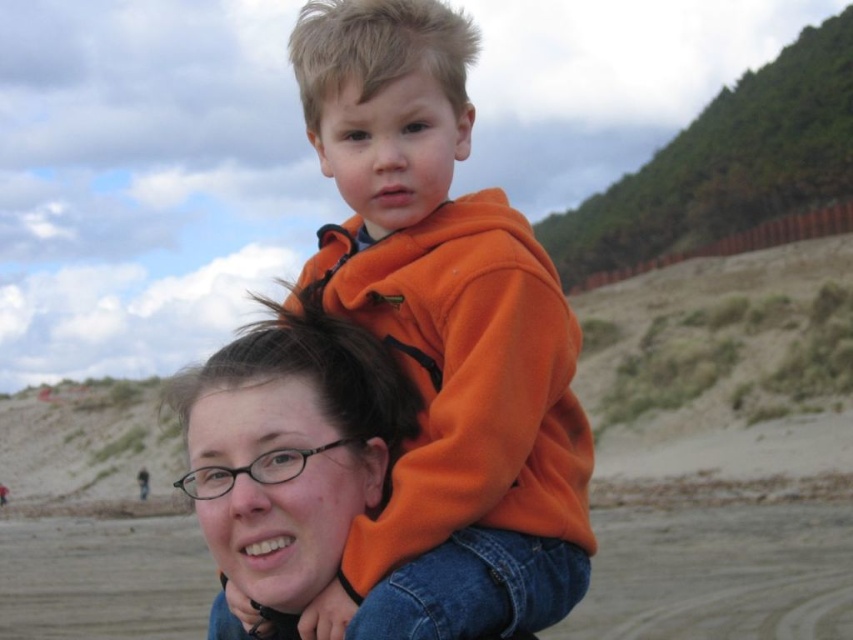
You are a fashion designer observing the scene. You notice the orange fleece at center and the matte orange hoodie at center. Which clothing item has a greater horizontal span when viewed from your perspective?

The orange fleece at center has a greater horizontal span than the matte orange hoodie at center since its width surpasses the latter.

From the picture: You are taking a photo of the scene and want to focus on the two points in the image. Which point, point (x=416, y=628) or point (x=248, y=420), is closer to the camera?

Point (x=416, y=628) is closer to the camera than point (x=248, y=420).

You are a fashion designer observing the image. You need to determine which clothing item is taller between the orange fleece at center and the matte orange hoodie at center. Which one is taller?

The orange fleece at center is much taller than the matte orange hoodie at center.